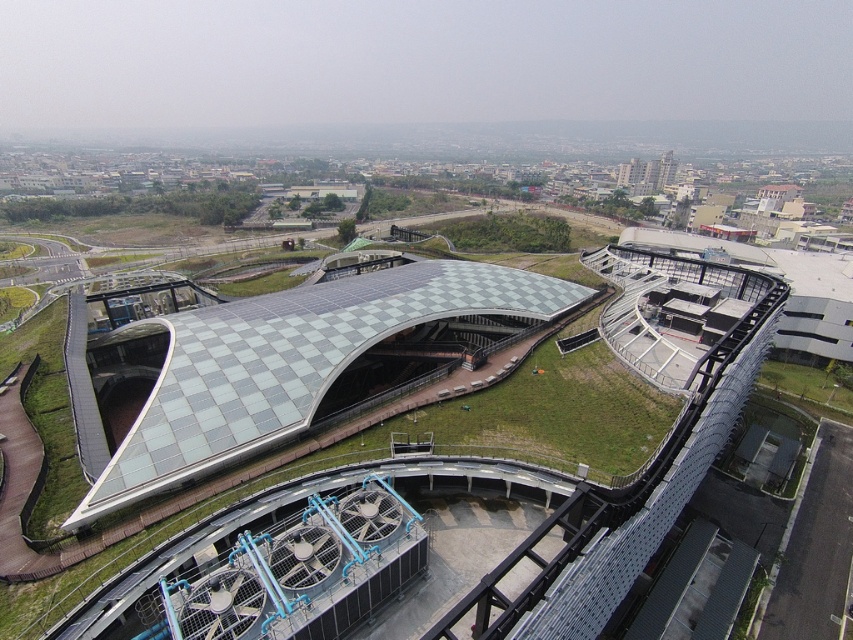
Between checkered glass roof at center and green grass at lower right, which one has more height?

Standing taller between the two is checkered glass roof at center.

Which of these two, checkered glass roof at center or green grass at lower right, stands shorter?

green grass at lower right is shorter.

Locate an element on the screen. This screenshot has height=640, width=853. checkered glass roof at center is located at coordinates (289, 365).